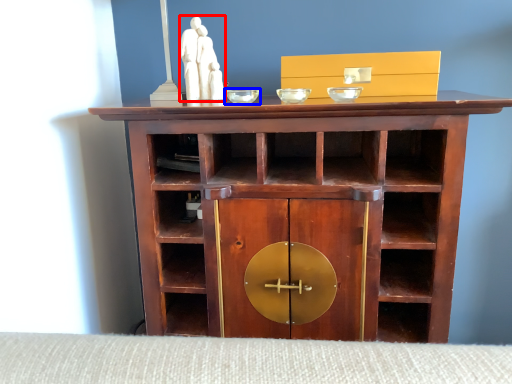
Question: Among these objects, which one is nearest to the camera, sculpture (highlighted by a red box) or glass bowl (highlighted by a blue box)?

Choices:
 (A) sculpture
 (B) glass bowl

Answer: (B)